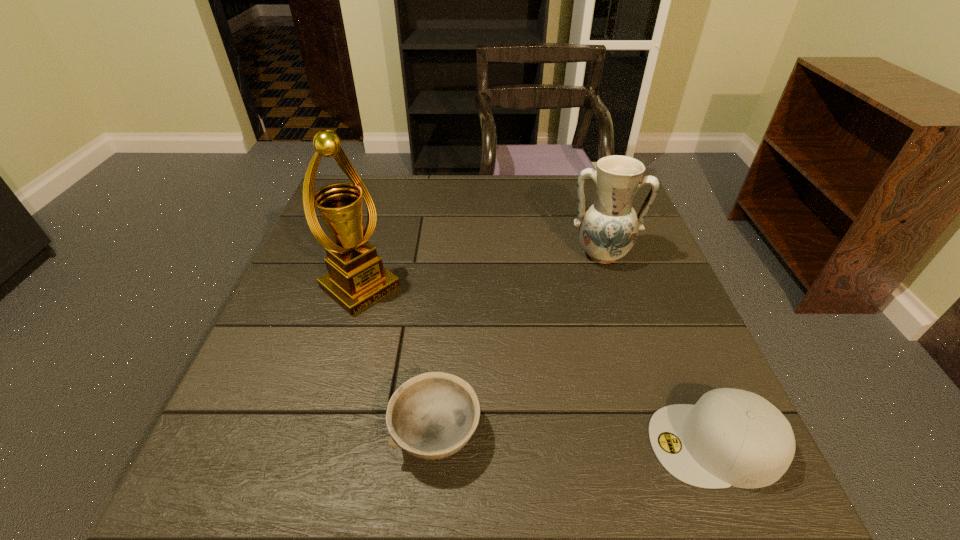
Identify the location of free space on the desktop that is between the bowl and the second shortest object and is positioned on either side of the pottery. (594, 440).

What are the coordinates of `free spot on the desktop that is between the bowl and the third tallest object and is positioned on the front-facing side of the tallest object` in the screenshot? It's located at (544, 437).